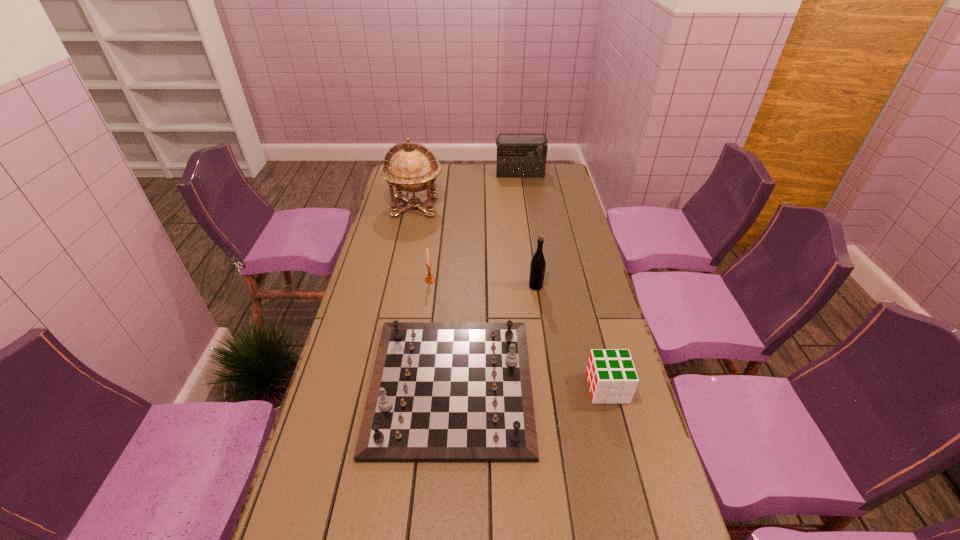
At what (x,y) coordinates should I click in order to perform the action: click on vacant space located 0.310m on the red face of the cube. Please return your answer as a coordinate pair (x, y). The image size is (960, 540). Looking at the image, I should click on (478, 388).

I want to click on vacant region located 0.320m on the red face of the cube, so click(475, 388).

This screenshot has height=540, width=960. I want to click on free location located 0.100m on the red face of the cube, so pyautogui.click(x=553, y=388).

Image resolution: width=960 pixels, height=540 pixels. What are the coordinates of `vacant space situated on the board of the chessboard` in the screenshot? It's located at (555, 385).

This screenshot has height=540, width=960. I want to click on object that is positioned at the far edge, so click(x=516, y=157).

This screenshot has height=540, width=960. I want to click on globe situated at the left edge, so click(x=414, y=168).

The image size is (960, 540). Identify the location of chessboard located at the left edge. (440, 391).

The image size is (960, 540). What are the coordinates of `radio receiver present at the right edge` in the screenshot? It's located at (516, 157).

This screenshot has height=540, width=960. In order to click on cube that is at the right edge in this screenshot , I will do `click(611, 375)`.

Find the location of a particular element. Image resolution: width=960 pixels, height=540 pixels. object at the far right corner is located at coordinates (516, 157).